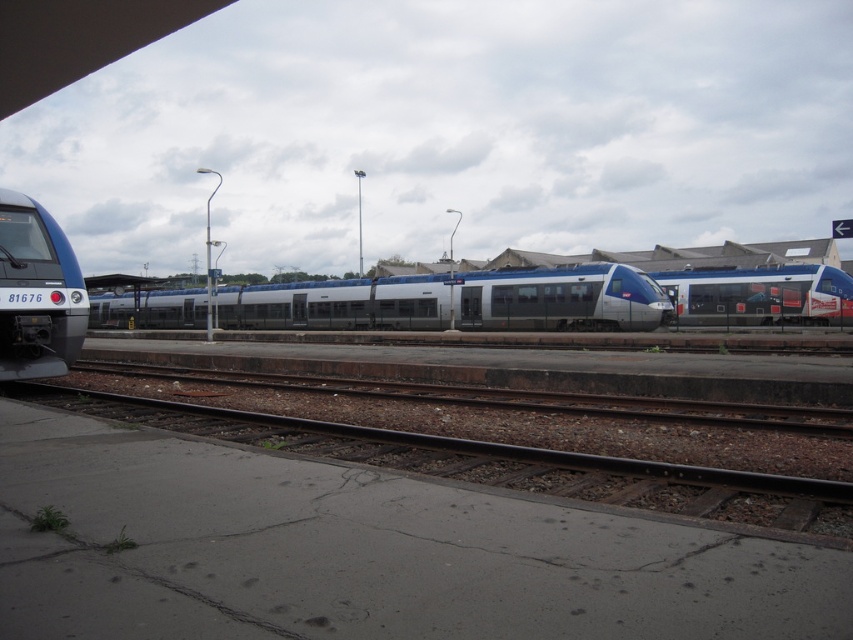
Can you confirm if brown gravel track at lower center is thinner than blue glossy train at left?

Incorrect, brown gravel track at lower center's width is not less than blue glossy train at left's.

Who is more distant from viewer, (254,444) or (74,276)?

Positioned behind is point (74,276).

Find the location of a particular element. brown gravel track at lower center is located at coordinates (488, 464).

Where is `brown gravel track at lower center`? The height and width of the screenshot is (640, 853). brown gravel track at lower center is located at coordinates (488, 464).

Which is behind, point (735, 518) or point (704, 285)?

The point (704, 285) is more distant.

Does brown gravel track at lower center appear on the right side of silver metallic train at right?

In fact, brown gravel track at lower center is to the left of silver metallic train at right.

Is point (572, 465) less distant than point (798, 272)?

Yes, point (572, 465) is in front of point (798, 272).

The width and height of the screenshot is (853, 640). I want to click on brown gravel track at lower center, so click(488, 464).

Does brown gravel track at lower center appear on the left side of silver metallic train at center?

In fact, brown gravel track at lower center is to the right of silver metallic train at center.

Which is more to the right, brown gravel track at lower center or silver metallic train at center?

brown gravel track at lower center

The image size is (853, 640). Identify the location of brown gravel track at lower center. (488, 464).